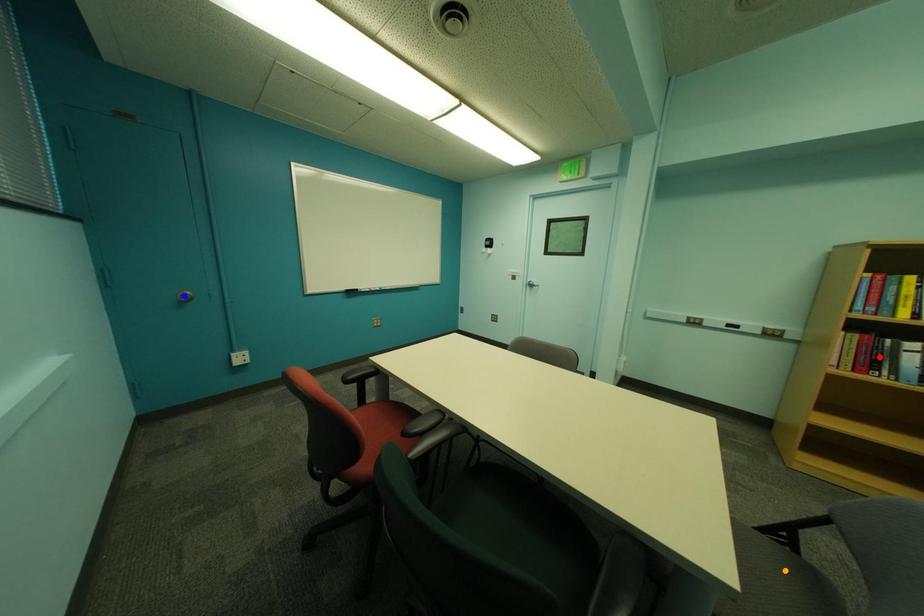
Order these from nearest to farthest:
- red point
- orange point
- blue point

blue point → red point → orange point